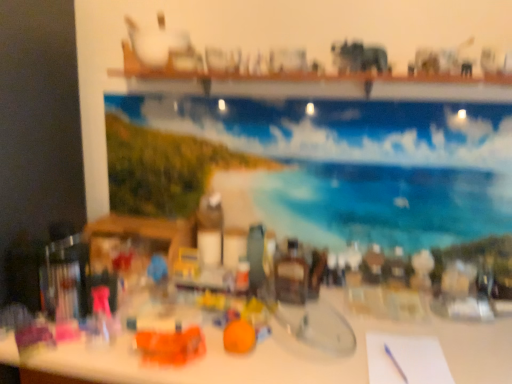
This screenshot has width=512, height=384. Find the location of `free space in front of orange matte toy at center, which is counted as the first toy, starting from the right`. free space in front of orange matte toy at center, which is counted as the first toy, starting from the right is located at coordinates [237, 372].